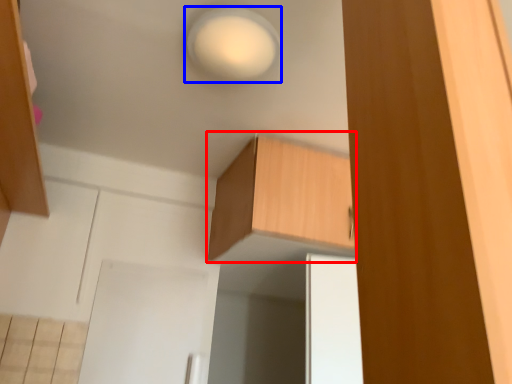
Question: Which of the following is the farthest to the observer, cabinetry (highlighted by a red box) or light (highlighted by a blue box)?

Choices:
 (A) cabinetry
 (B) light

Answer: (A)